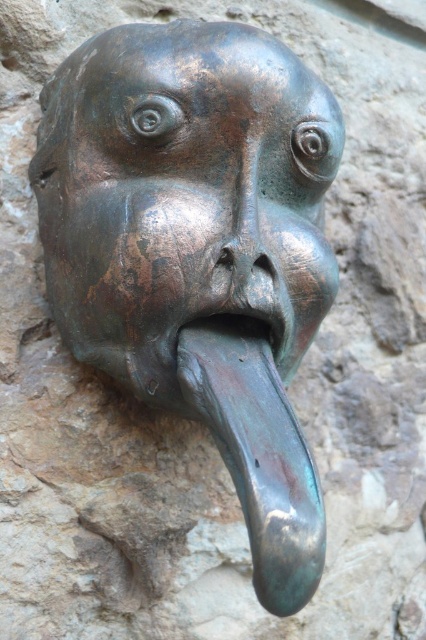
Question: Which of the following is the farthest from the observer?

Choices:
 (A) (273, 324)
 (B) (55, 90)

Answer: (B)

Question: Is bronze sculpture at center behind bronze textured nose at center?

Choices:
 (A) yes
 (B) no

Answer: (B)

Question: Which of the following is the closest to the observer?

Choices:
 (A) (222, 300)
 (B) (233, 285)
 (C) (221, 323)

Answer: (B)

Question: Is bronze sculpture at center wider than bronze textured nose at center?

Choices:
 (A) no
 (B) yes

Answer: (B)

Question: Is bronze sculpture at center smaller than shiny bronze mouth at center?

Choices:
 (A) no
 (B) yes

Answer: (A)

Question: Which is nearer to the bronze sculpture at center?

Choices:
 (A) bronze textured nose at center
 (B) shiny bronze mouth at center

Answer: (A)